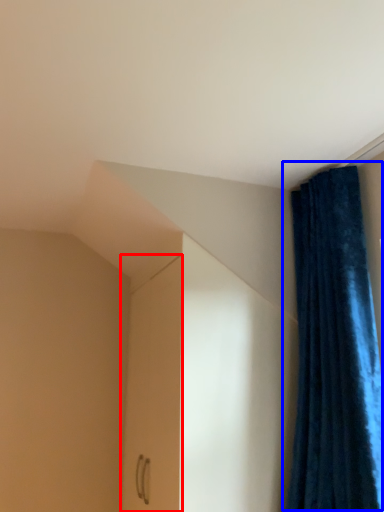
Question: Among these objects, which one is farthest to the camera, screen door (highlighted by a red box) or curtain (highlighted by a blue box)?

Choices:
 (A) screen door
 (B) curtain

Answer: (A)